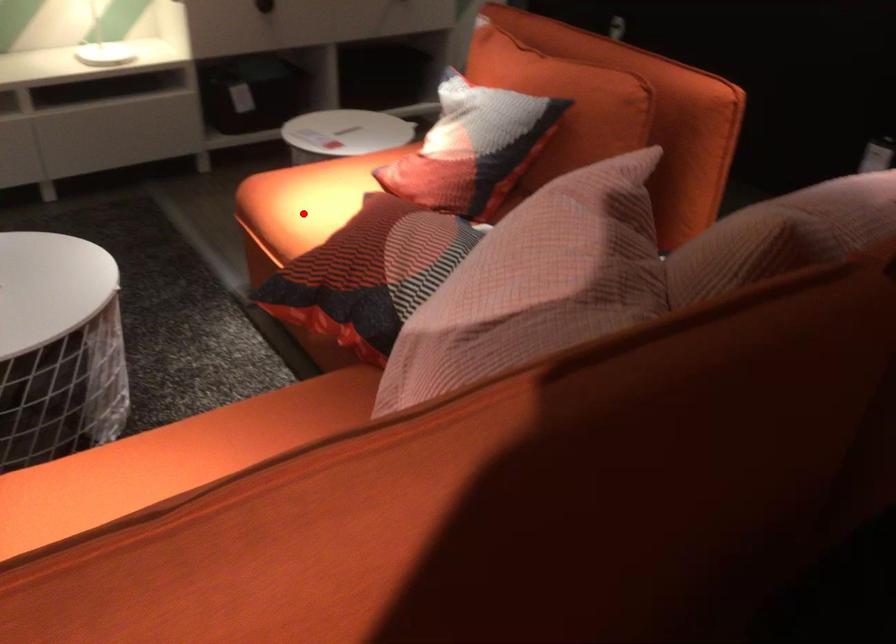
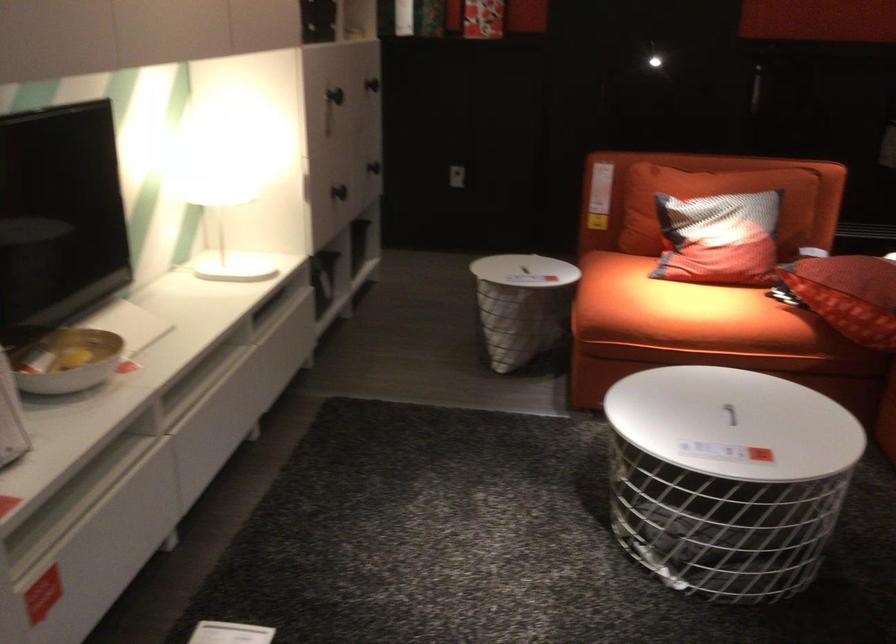
Find the pixel in the second image that matches the highlighted location in the first image.

(684, 312)